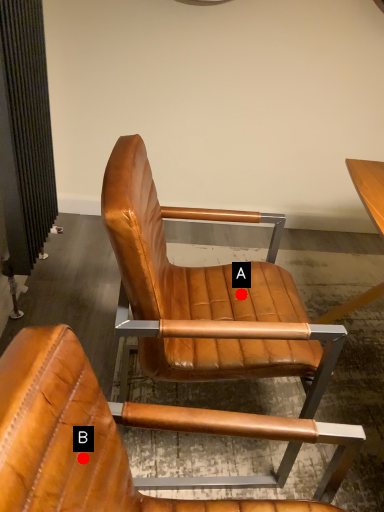
Question: Two points are circled on the image, labeled by A and B beside each circle. Which point is farther from the camera taking this photo?

Choices:
 (A) A is further
 (B) B is further

Answer: (A)